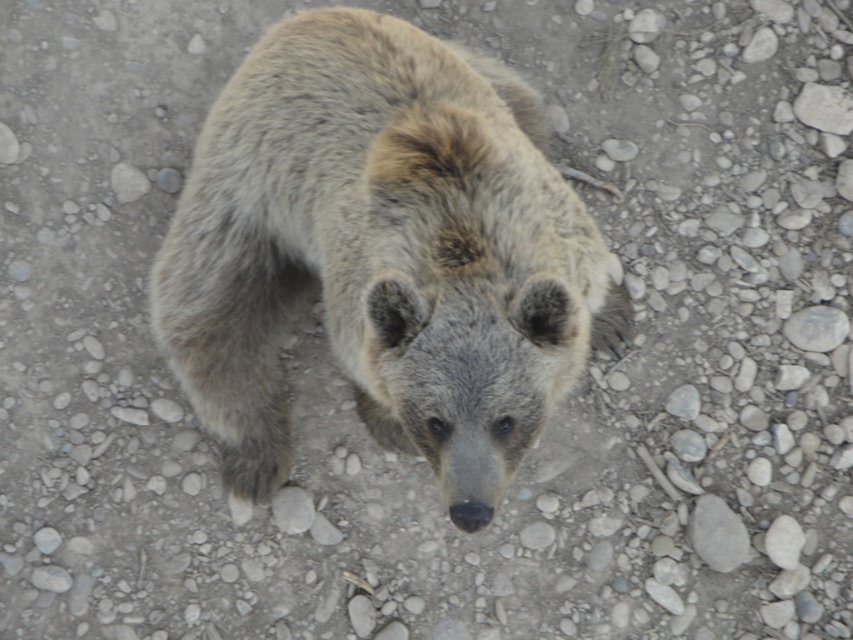
Question: Which object is the farthest from the gray smooth rock at center-right?

Choices:
 (A) gray smooth rock at lower right
 (B) fuzzy fur bear at center

Answer: (B)

Question: Is fuzzy fur bear at center behind gray smooth rock at center-right?

Choices:
 (A) yes
 (B) no

Answer: (B)

Question: From the image, what is the correct spatial relationship of gray smooth rock at lower right in relation to gray smooth rock at center-right?

Choices:
 (A) above
 (B) below

Answer: (B)

Question: Which of the following is the farthest from the observer?

Choices:
 (A) (469, 61)
 (B) (711, 554)

Answer: (A)

Question: Estimate the real-world distances between objects in this image. Which object is farther from the fuzzy fur bear at center?

Choices:
 (A) gray smooth rock at lower right
 (B) gray smooth rock at center-right

Answer: (B)

Question: Considering the relative positions of gray smooth rock at lower right and gray smooth rock at center-right in the image provided, where is gray smooth rock at lower right located with respect to gray smooth rock at center-right?

Choices:
 (A) right
 (B) left

Answer: (B)